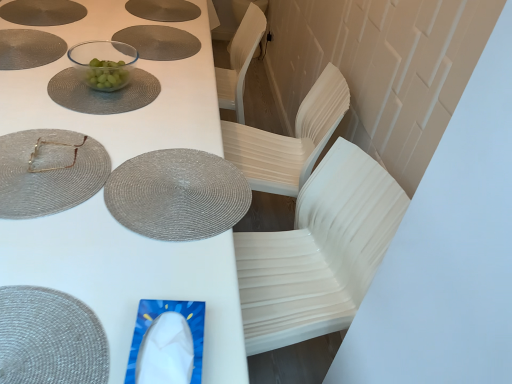
Identify the location of free space in front of silver textured placemat at center, which is counted as the 3th tableware, starting from the top. (142, 266).